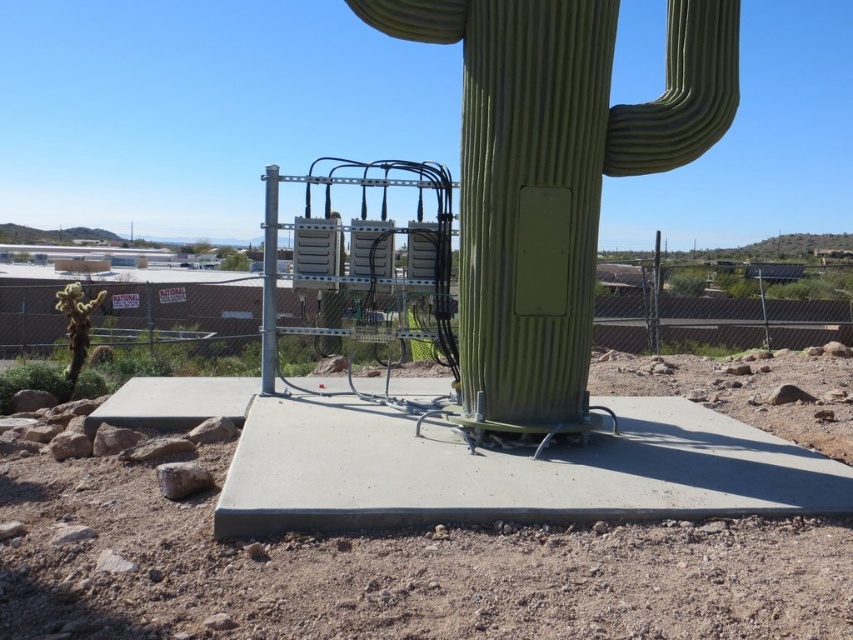
Consider the image. You are standing in a desert and want to take a photo of the green matte cactus at center. If your camera has a maximum focus range of 15 feet, will you need to move closer to the cactus to get a clear shot?

The green matte cactus at center is 15.96 feet away from the viewer. Since the camera can only focus up to 15 feet, you need to move closer to ensure the cactus is within the focus range.

You are standing in the desert scene and want to place a small flag at each of the two points marked in the image. Which point, point 1 at coordinates (723, 129) or point 2 at coordinates (76, 374), will require you to walk further away from your current position to reach?

Point 2 at coordinates (76, 374) requires walking further away because it is farther from the camera compared to point 1 at coordinates (723, 129).

You are a gardener planning to plant a new cactus between the green matte cactus at center and the green matte cactus at lower left. Based on their sizes, which cactus should you place closer to the new one to ensure enough space?

The green matte cactus at center might be wider than the green matte cactus at lower left, so you should place the new cactus closer to the green matte cactus at lower left to ensure enough space.